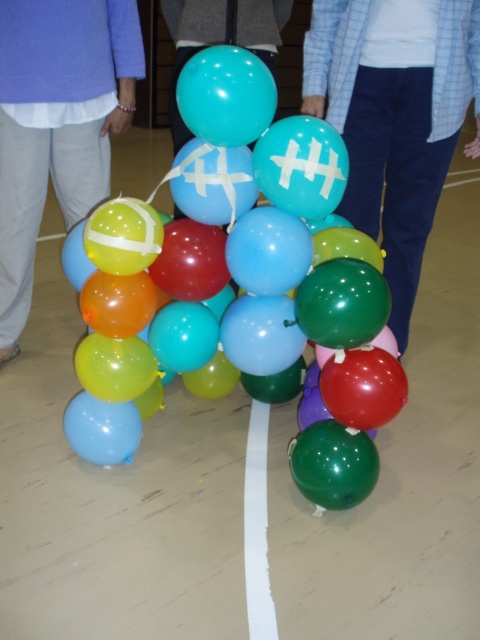
Is point (399, 180) positioned after point (215, 20)?

No, it is in front of (215, 20).

What do you see at coordinates (394, 125) in the screenshot?
I see `blue plaid shirt at center` at bounding box center [394, 125].

Does point (354, 140) lie behind point (212, 16)?

No, it is in front of (212, 16).

Find the location of a particular element. The width and height of the screenshot is (480, 640). blue plaid shirt at center is located at coordinates (394, 125).

Who is shorter, glossy rubber balloons at center or matte blue pants at lower left?

glossy rubber balloons at center

Which is behind, point (156, 244) or point (54, 100)?

The point (54, 100) is more distant.

What do you see at coordinates (240, 282) in the screenshot? I see `glossy rubber balloons at center` at bounding box center [240, 282].

Identify the location of glossy rubber balloons at center. (240, 282).

Measure the distance between point (123, 80) and camera.

They are 2.28 meters apart.

Is matte blue pants at lower left smaller than glossy teal balloon at center?

No.

Which is behind, point (48, 80) or point (249, 48)?

The point (249, 48) is behind.

The height and width of the screenshot is (640, 480). I want to click on matte blue pants at lower left, so click(x=57, y=122).